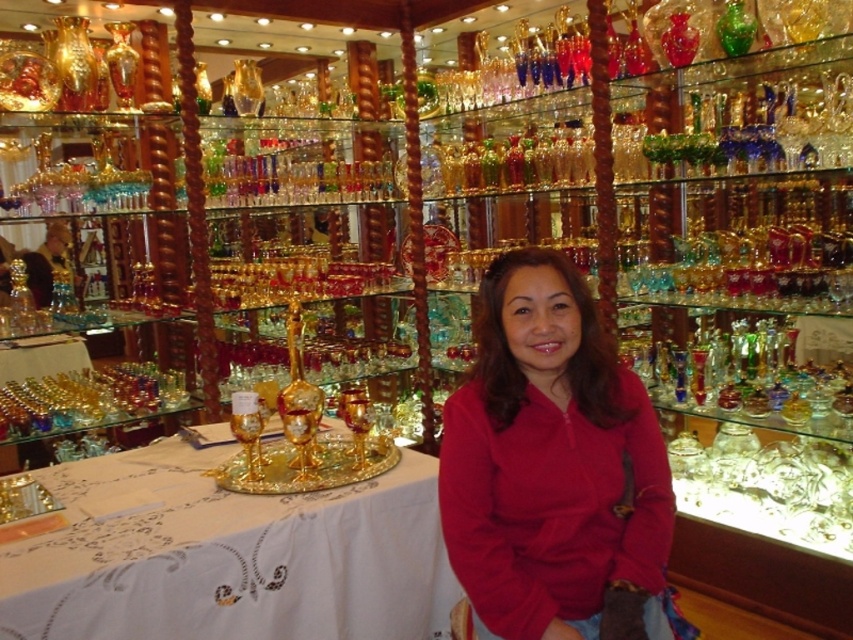
You are a customer in the glassware shop and want to touch the white embroidered tablecloth at center and the matte red sweater at center. Which one can you reach without moving your current position?

The white embroidered tablecloth at center is closer to the viewer than the matte red sweater at center, so you can reach the white embroidered tablecloth at center without moving.

You are a customer entering the glassware shop and see the white embroidered tablecloth at center and the matte red sweater at center. From your perspective, which object is positioned to the left?

The white embroidered tablecloth at center is to the left of the matte red sweater at center, so the white embroidered tablecloth at center is positioned to the left.

You are a customer in the store and want to place a small gift box on the table. The gift box is wider than the matte red sweater at center. Will it fit on the white embroidered tablecloth at center?

The white embroidered tablecloth at center is wider than the matte red sweater at center. Since the gift box is wider than the matte red sweater at center, it might still fit on the white embroidered tablecloth at center, provided there is enough space. However, the exact dimensions aren